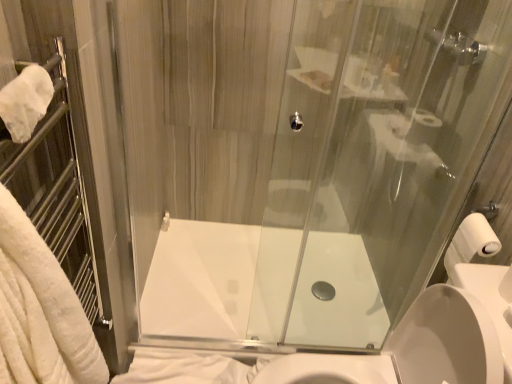
Question: Is white glossy sink at center aimed at transparent glass shower door at center?

Choices:
 (A) yes
 (B) no

Answer: (B)

Question: Does white glossy sink at center have a greater height compared to transparent glass shower door at center?

Choices:
 (A) no
 (B) yes

Answer: (A)

Question: Is white glossy sink at center turned away from transparent glass shower door at center?

Choices:
 (A) no
 (B) yes

Answer: (A)

Question: Can you confirm if white glossy sink at center is bigger than transparent glass shower door at center?

Choices:
 (A) yes
 (B) no

Answer: (A)

Question: Is white glossy sink at center placed right next to transparent glass shower door at center?

Choices:
 (A) yes
 (B) no

Answer: (B)

Question: Considering the relative positions of white glossy sink at center and transparent glass shower door at center in the image provided, is white glossy sink at center to the right of transparent glass shower door at center from the viewer's perspective?

Choices:
 (A) yes
 (B) no

Answer: (A)

Question: From the image's perspective, is white matte toilet paper at right above white soft towel at lower left, positioned as the second bath towel in front-to-back order?

Choices:
 (A) yes
 (B) no

Answer: (A)

Question: Is white matte toilet paper at right facing towards white soft towel at lower left, positioned as the second bath towel in front-to-back order?

Choices:
 (A) no
 (B) yes

Answer: (A)

Question: Is the depth of white matte toilet paper at right less than that of white soft towel at lower left, which is the first bath towel in back-to-front order?

Choices:
 (A) yes
 (B) no

Answer: (A)

Question: Can you see white matte toilet paper at right touching white soft towel at lower left, marked as the first bath towel in a bottom-to-top arrangement?

Choices:
 (A) no
 (B) yes

Answer: (A)

Question: Is white soft towel at lower left, which is the first bath towel in back-to-front order, located within white matte toilet paper at right?

Choices:
 (A) yes
 (B) no

Answer: (B)

Question: Is white matte toilet paper at right looking in the opposite direction of white soft towel at lower left, the 2th bath towel viewed from the top?

Choices:
 (A) no
 (B) yes

Answer: (A)

Question: From the image's perspective, would you say white matte toilet paper at right is positioned over transparent glass shower door at center?

Choices:
 (A) yes
 (B) no

Answer: (B)